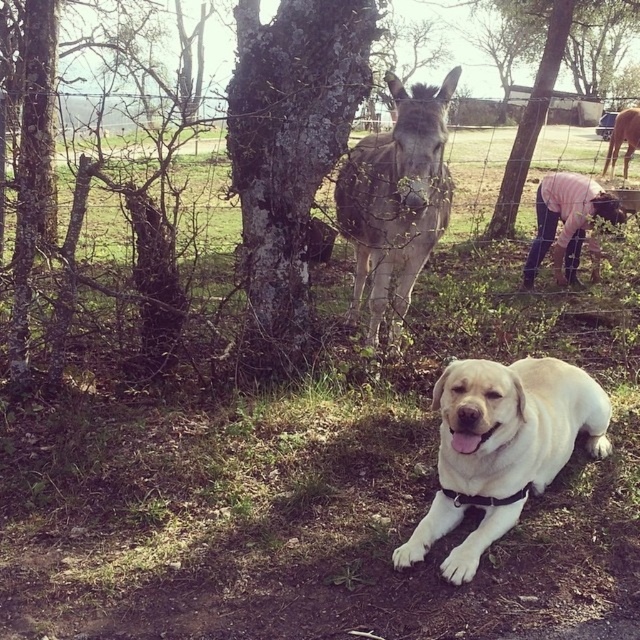
Question: Which point is farther from the camera taking this photo?

Choices:
 (A) (502, 520)
 (B) (364, 198)
 (C) (280, 122)
 (D) (620, 125)

Answer: (D)

Question: Which object is positioned closest to the dark gray bark tree at center?

Choices:
 (A) yellow matte dog at lower center
 (B) brown fur horse at upper right
 (C) grayish-brown fur at center
 (D) smooth bark tree at center

Answer: (D)

Question: From the image, what is the correct spatial relationship of smooth bark tree at center in relation to grayish-brown fur at center?

Choices:
 (A) below
 (B) above

Answer: (B)

Question: Can you confirm if yellow matte dog at lower center is positioned to the left of brown fur horse at upper right?

Choices:
 (A) yes
 (B) no

Answer: (A)

Question: Is smooth bark tree at center to the right of yellow matte dog at lower center from the viewer's perspective?

Choices:
 (A) yes
 (B) no

Answer: (B)

Question: Which point appears closest to the camera in this image?

Choices:
 (A) (628, 145)
 (B) (368, 273)

Answer: (B)